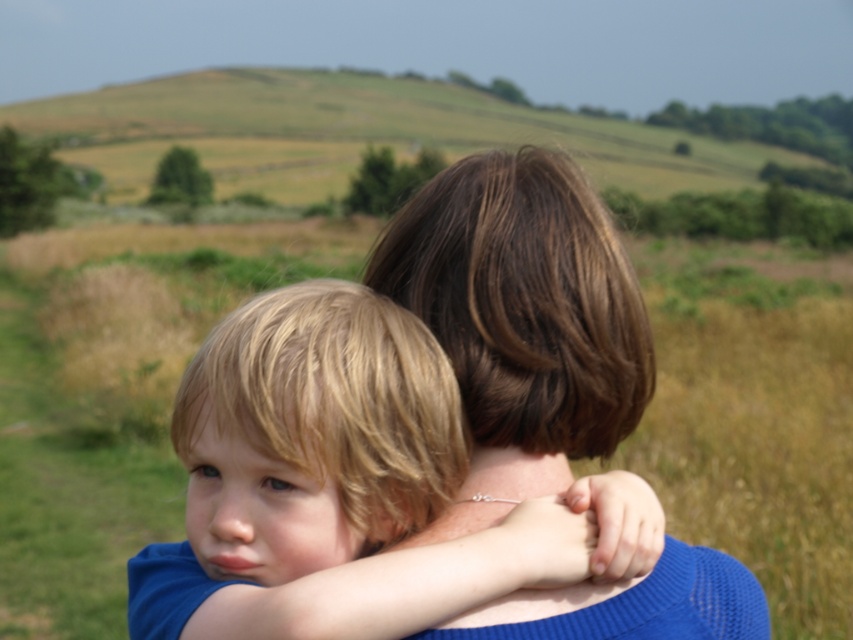
You are standing in the scene and want to locate the blonde hair at center. According to the coordinates provided, where should you look relative to the center of the image?

The blonde hair at center is located at coordinates point (341,483), which means it is to the right and slightly above the center of the image.

You are a photographer trying to capture the perfect shot of the two people in the center. Since you want to focus on their interaction, you need to ensure their hair is visible. Given that the blonde hair at center is wider than the brown hair at center, which hair should you adjust your camera angle to prioritize capturing first?

The blonde hair at center is wider than the brown hair at center, so you should prioritize adjusting your camera angle to capture the blonde hair at center first to ensure it is fully visible in the frame.

You are a photographer standing in front of the scene. You want to take a closeup photo of the blonde hair at center. If your camera can focus on objects within 1 meter, will you be able to take the photo?

The blonde hair at center is 86.75 centimeters from viewer, which is within the 1 meter focus range. Yes, you can take the closeup photo.